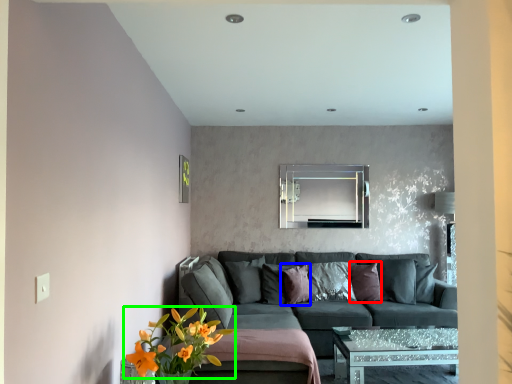
Question: Which is farther away from pillow (highlighted by a red box)? pillow (highlighted by a blue box) or flower (highlighted by a green box)?

Choices:
 (A) pillow
 (B) flower

Answer: (B)